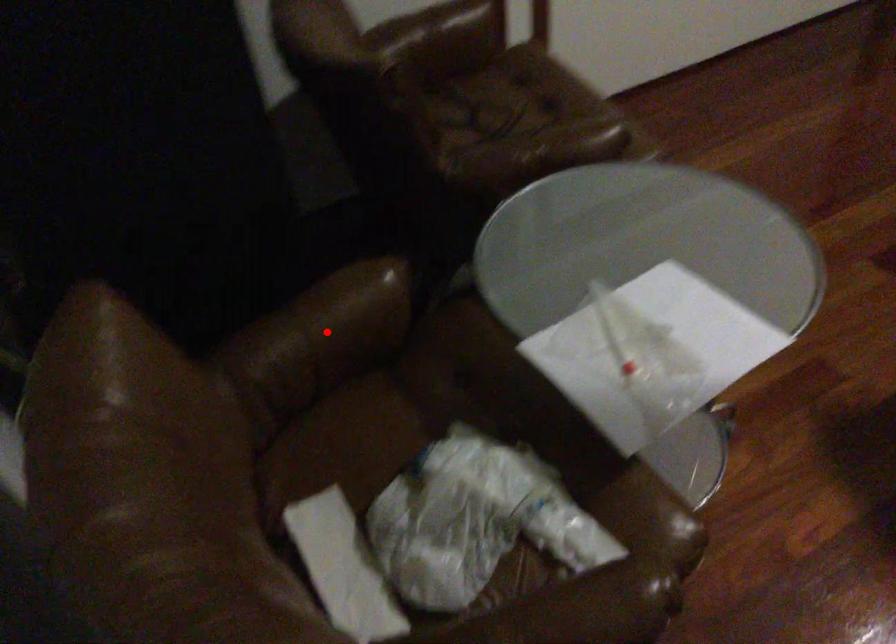
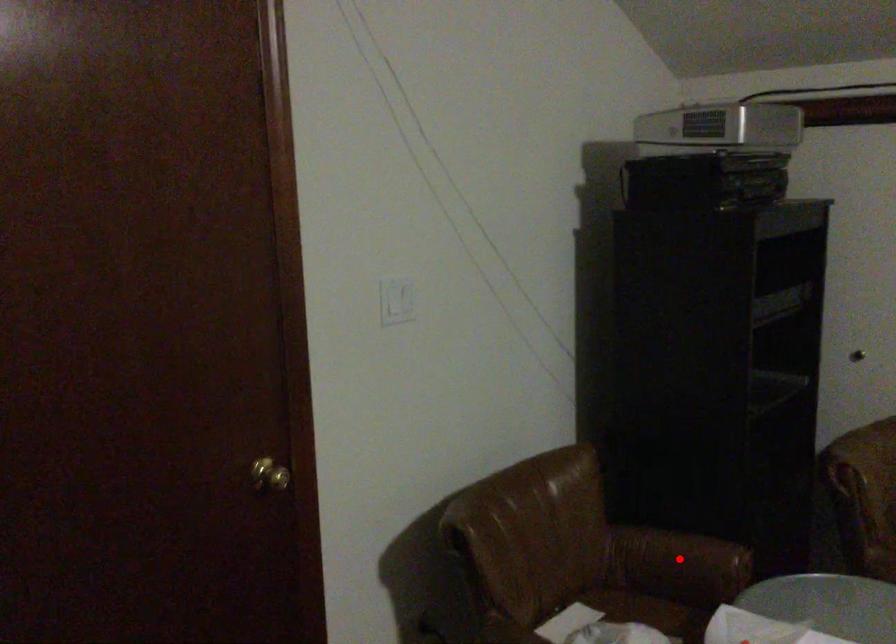
I am providing you with two images of the same scene from different viewpoints. A red point is marked on the first image and another point is marked on the second image. Do the highlighted points in image1 and image2 indicate the same real-world spot?

Yes